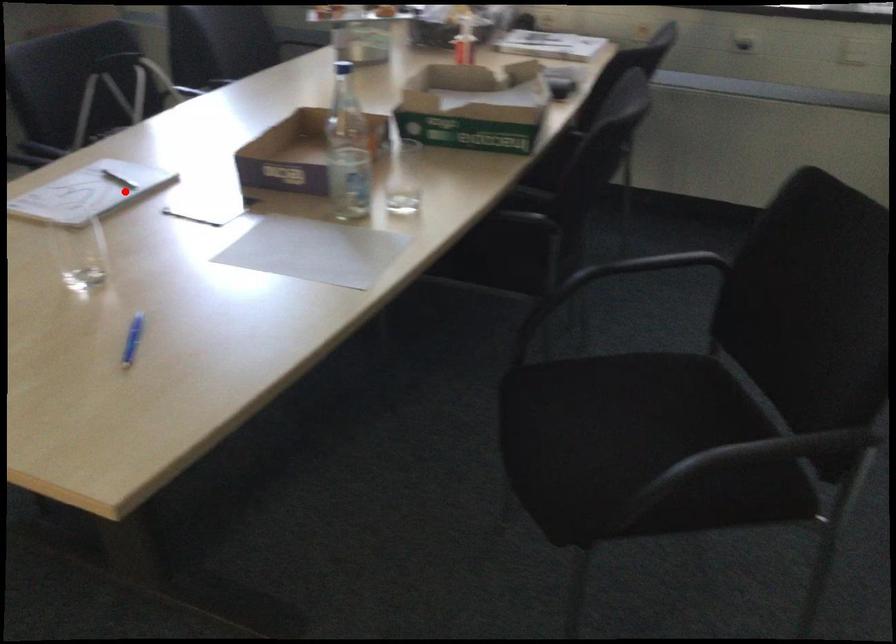
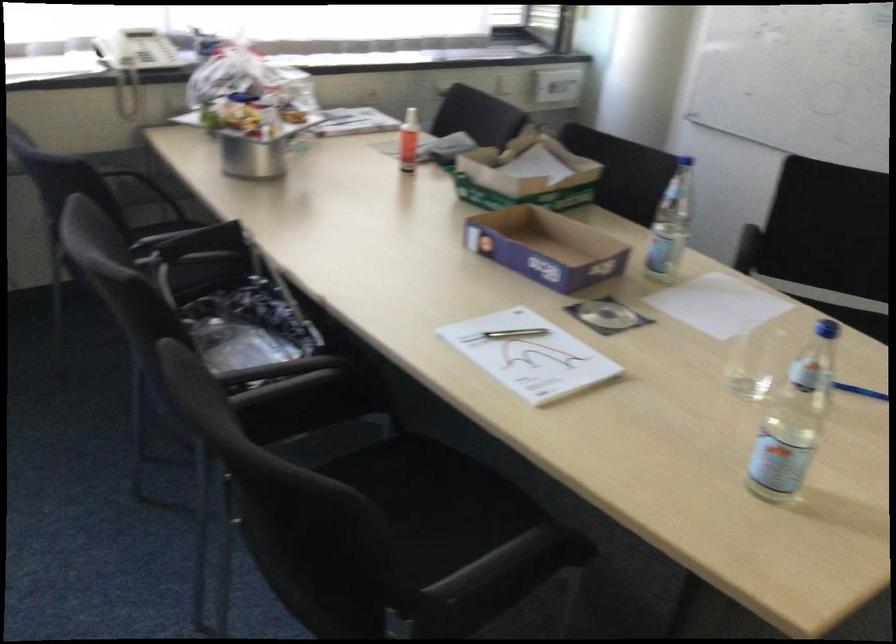
Find the pixel in the second image that matches the highlighted location in the first image.

(514, 333)